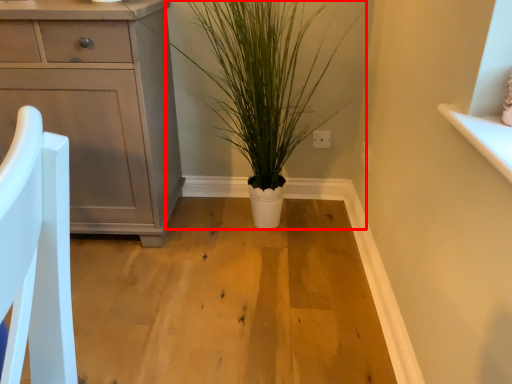
Question: Considering the relative positions of houseplant (annotated by the red box) and chest of drawers in the image provided, where is houseplant (annotated by the red box) located with respect to the staircase?

Choices:
 (A) left
 (B) right

Answer: (B)